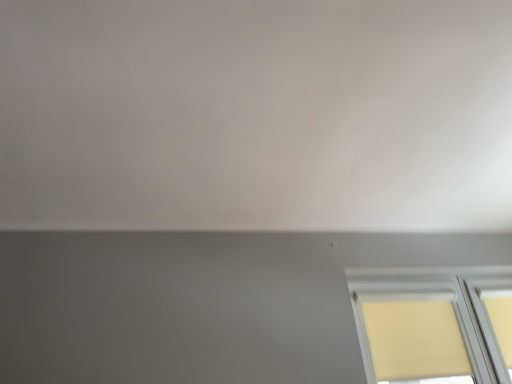
Question: Can you confirm if white matte wall at upper center is wider than beige fabric window at lower right?

Choices:
 (A) yes
 (B) no

Answer: (A)

Question: From the image's perspective, would you say white matte wall at upper center is shown under beige fabric window at lower right?

Choices:
 (A) no
 (B) yes

Answer: (A)

Question: Can you confirm if white matte wall at upper center is positioned to the right of beige fabric window at lower right?

Choices:
 (A) yes
 (B) no

Answer: (B)

Question: From a real-world perspective, is white matte wall at upper center on beige fabric window at lower right?

Choices:
 (A) no
 (B) yes

Answer: (B)

Question: Is white matte wall at upper center shorter than beige fabric window at lower right?

Choices:
 (A) no
 (B) yes

Answer: (B)

Question: Does white matte wall at upper center turn towards beige fabric window at lower right?

Choices:
 (A) yes
 (B) no

Answer: (B)

Question: Considering the relative positions of beige fabric window at lower right and white matte wall at upper center in the image provided, is beige fabric window at lower right in front of white matte wall at upper center?

Choices:
 (A) no
 (B) yes

Answer: (A)

Question: Is beige fabric window at lower right far away from white matte wall at upper center?

Choices:
 (A) no
 (B) yes

Answer: (B)

Question: Is white matte wall at upper center surrounded by beige fabric window at lower right?

Choices:
 (A) no
 (B) yes

Answer: (A)

Question: Is beige fabric window at lower right taller than white matte wall at upper center?

Choices:
 (A) yes
 (B) no

Answer: (A)

Question: Is beige fabric window at lower right at the left side of white matte wall at upper center?

Choices:
 (A) no
 (B) yes

Answer: (A)

Question: From a real-world perspective, is beige fabric window at lower right positioned under white matte wall at upper center based on gravity?

Choices:
 (A) no
 (B) yes

Answer: (B)

Question: In terms of height, does beige fabric window at lower right look taller or shorter compared to white matte wall at upper center?

Choices:
 (A) short
 (B) tall

Answer: (B)